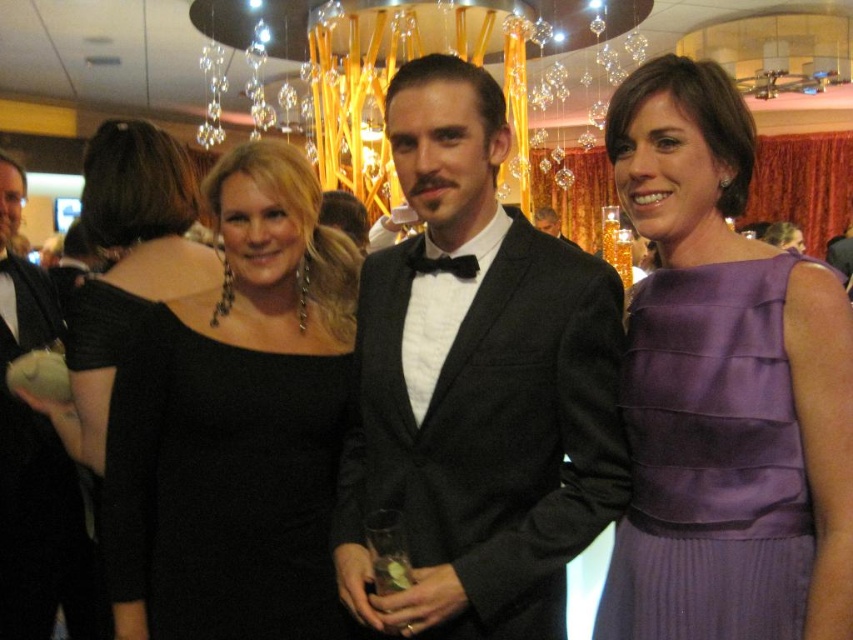
Between black satin bow tie at center and black satin tuxedo at center, which one appears on the right side from the viewer's perspective?

black satin tuxedo at center

Does black satin bow tie at center appear on the left side of black satin tuxedo at center?

Indeed, black satin bow tie at center is positioned on the left side of black satin tuxedo at center.

Who is more distant from viewer, (408, 257) or (567, 241)?

The point (567, 241) is behind.

Locate an element on the screen. black satin bow tie at center is located at coordinates (444, 264).

Is black satin dress at center behind matte black suit at center?

No, it is not.

What do you see at coordinates (236, 422) in the screenshot?
I see `black satin dress at center` at bounding box center [236, 422].

Image resolution: width=853 pixels, height=640 pixels. I want to click on black satin dress at center, so click(236, 422).

Does matte black suit at center lie in front of black satin tuxedo at center?

That is True.

Does matte black suit at center have a larger size compared to black satin tuxedo at center?

Yes, matte black suit at center is bigger than black satin tuxedo at center.

Which is behind, point (61, 497) or point (541, 209)?

The point (541, 209) is more distant.

What are the coordinates of `matte black suit at center` in the screenshot? It's located at (33, 460).